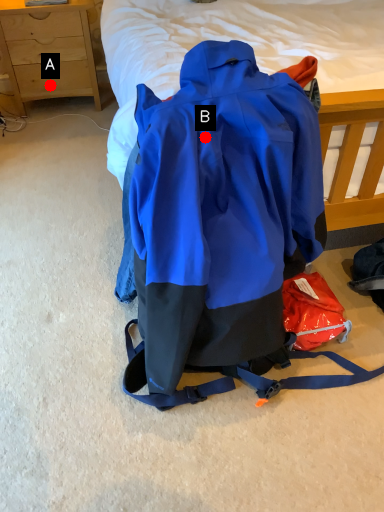
Question: Two points are circled on the image, labeled by A and B beside each circle. Among these points, which one is farthest from the camera?

Choices:
 (A) A is further
 (B) B is further

Answer: (A)